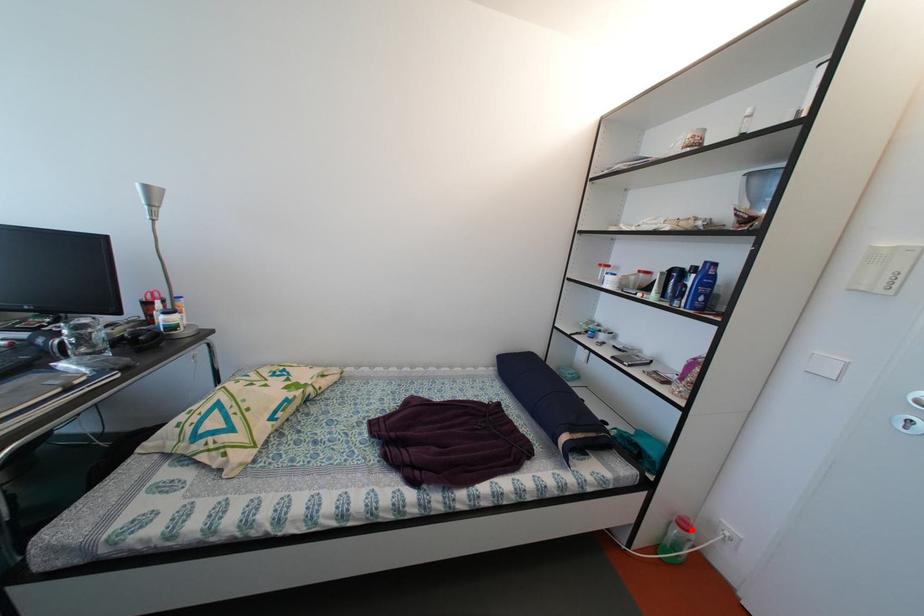
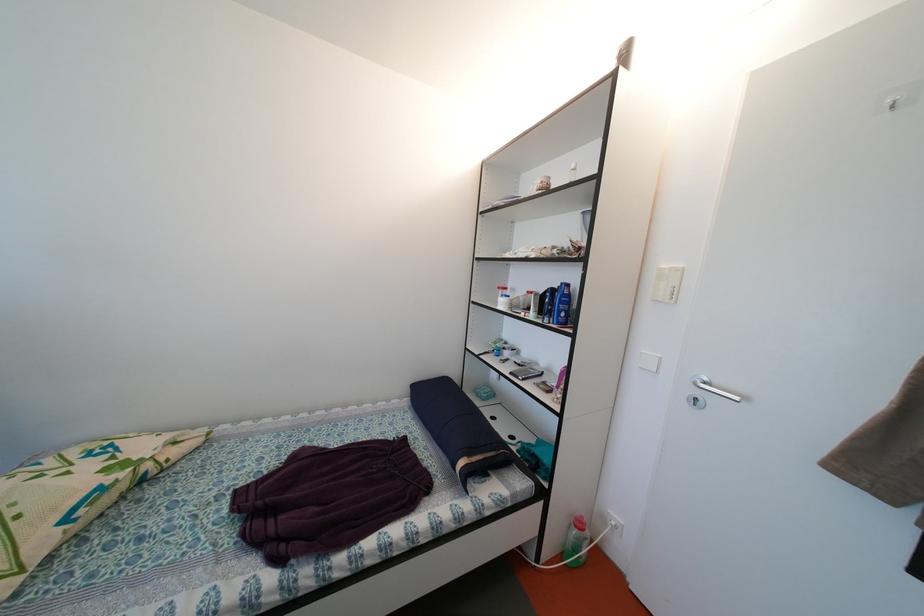
Locate, in the second image, the point that corresponds to the highlighted location in the first image.

(587, 530)